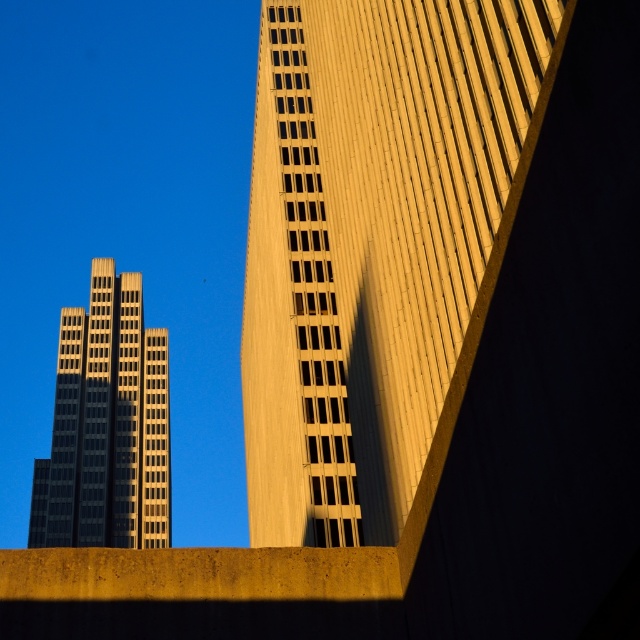
Which is behind, point (305, 339) or point (113, 280)?

Point (113, 280)

Identify the location of golden concrete building at upper right. (374, 243).